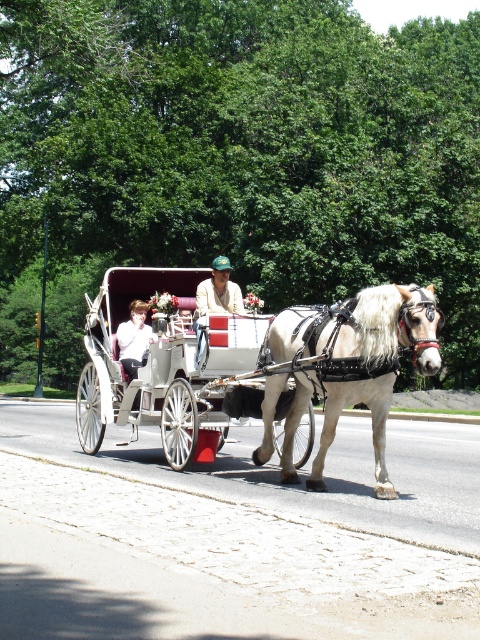
How much distance is there between white leather wagon at center and white glossy horse at center?

white leather wagon at center and white glossy horse at center are 1.74 meters apart.

Is white leather wagon at center positioned before white glossy horse at center?

No.

Does point (189, 342) come in front of point (422, 372)?

That is False.

Identify the location of white leather wagon at center. The image size is (480, 640). (162, 362).

Is white glossy horse at center to the left of light brown leather jacket at center from the viewer's perspective?

In fact, white glossy horse at center is to the right of light brown leather jacket at center.

Is point (277, 349) in front of point (202, 296)?

Yes, point (277, 349) is in front of point (202, 296).

This screenshot has width=480, height=640. In order to click on white glossy horse at center in this screenshot , I will do `click(355, 364)`.

In the scene shown: Does white leather wagon at center appear on the right side of white cotton shirt at center?

Indeed, white leather wagon at center is positioned on the right side of white cotton shirt at center.

Is white leather wagon at center taller than white cotton shirt at center?

Correct, white leather wagon at center is much taller as white cotton shirt at center.

Measure the distance between white leather wagon at center and camera.

The distance of white leather wagon at center from camera is 9.42 meters.

Where is `white leather wagon at center`? The width and height of the screenshot is (480, 640). white leather wagon at center is located at coordinates (162, 362).